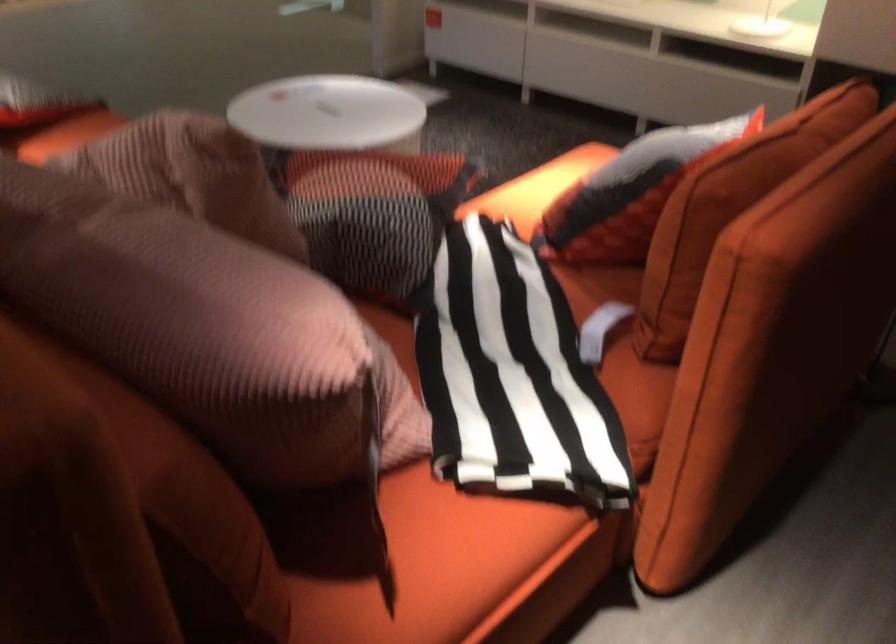
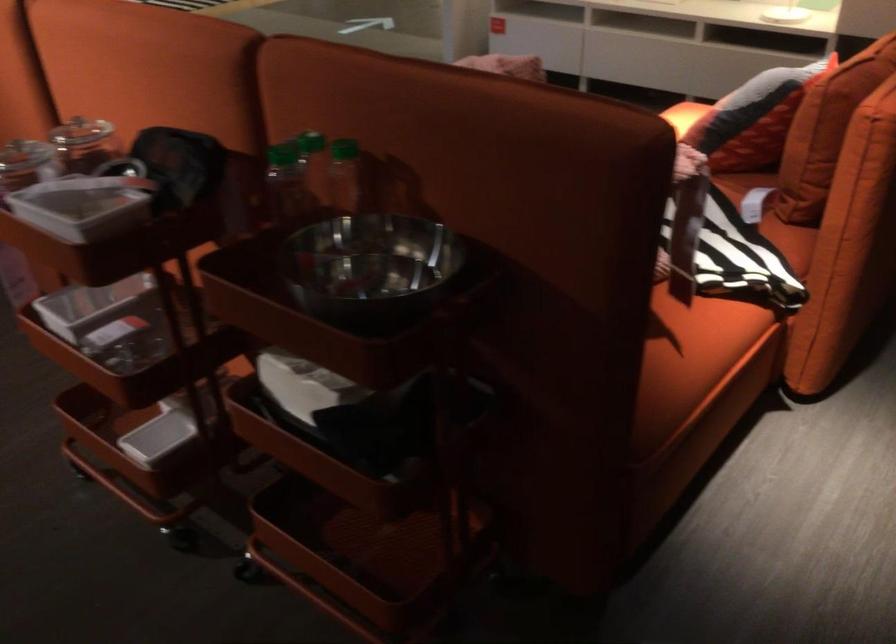
Question: Based on the continuous images, in which direction is the camera rotating? Reply with the corresponding letter.

Choices:
 (A) Left
 (B) Right
 (C) Up
 (D) Down

Answer: (C)